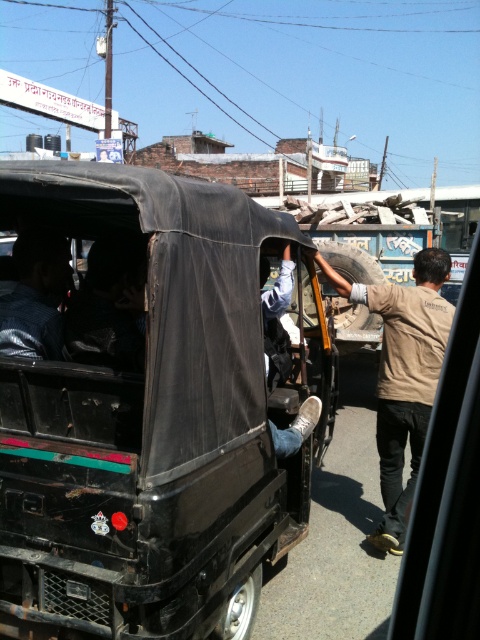
Consider the image. Is black matte jeep at center taller than dark blue shirt at rear left?

Yes, black matte jeep at center is taller than dark blue shirt at rear left.

Based on the photo, is black matte jeep at center bigger than dark blue shirt at rear left?

Yes, black matte jeep at center is bigger than dark blue shirt at rear left.

Describe the element at coordinates (147, 403) in the screenshot. I see `black matte jeep at center` at that location.

Identify the location of black matte jeep at center. (147, 403).